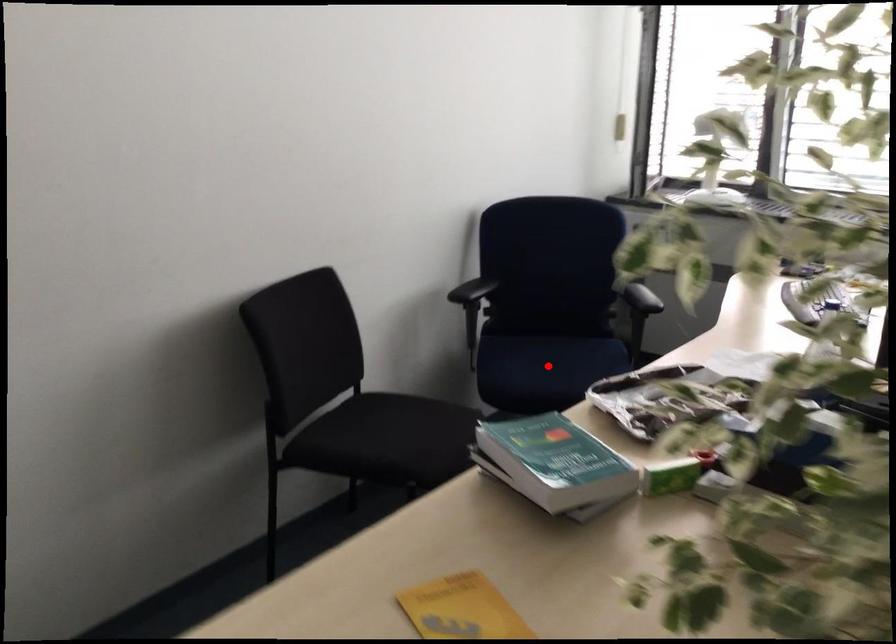
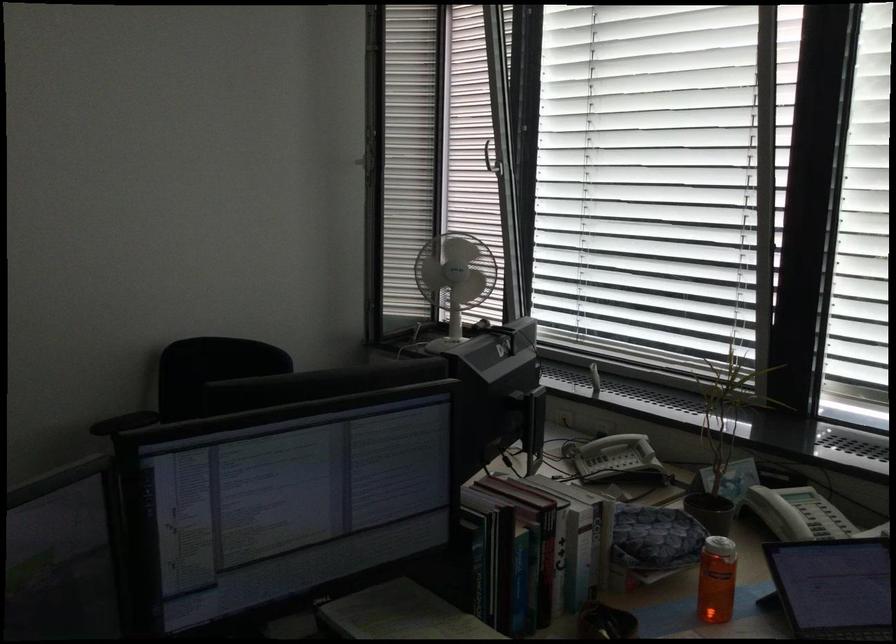
Question: I am providing you with two images of the same scene from different viewpoints. A red point is marked on the first image. Can you still see the location of the red point in image 2?

Choices:
 (A) Yes
 (B) No

Answer: (B)